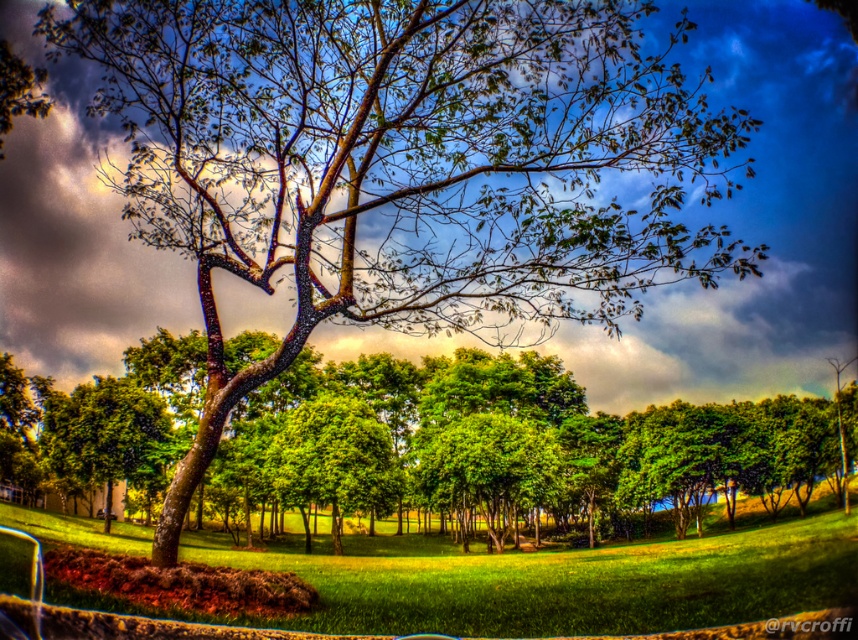
Does green leafy tree at center have a lesser height compared to green grassy field at center?

No.

Is point (613, 492) positioned before point (342, 605)?

No, (613, 492) is behind (342, 605).

The height and width of the screenshot is (640, 858). I want to click on green leafy tree at center, so click(529, 445).